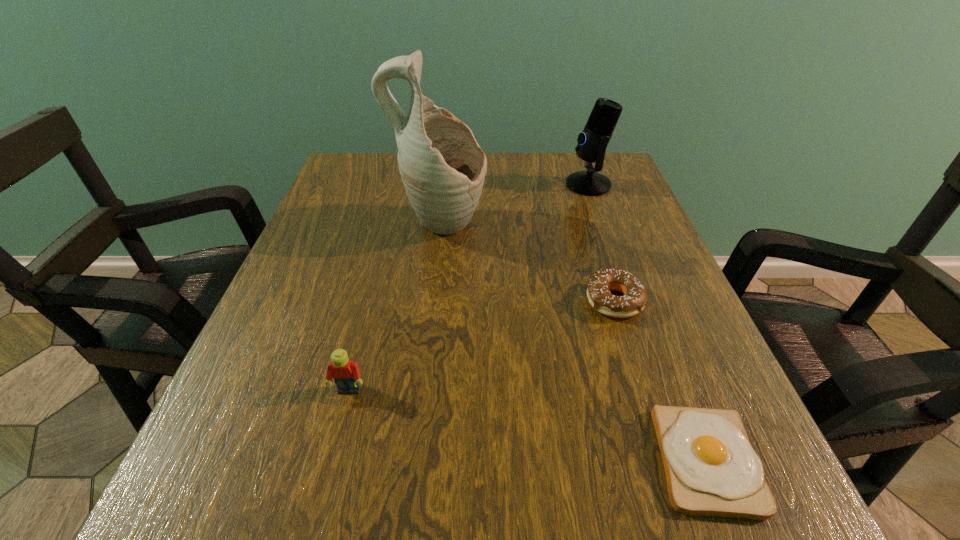
This screenshot has height=540, width=960. I want to click on the fourth nearest object, so click(x=443, y=168).

You are a GUI agent. You are given a task and a screenshot of the screen. Output one action in this format:
    pyautogui.click(x=<x>, y=<y>)
    Task: Click on the tallest object
    
    Given the screenshot: What is the action you would take?
    pyautogui.click(x=443, y=168)

Identify the location of the farthest object. The height and width of the screenshot is (540, 960). (592, 142).

You are a GUI agent. You are given a task and a screenshot of the screen. Output one action in this format:
    pyautogui.click(x=<x>, y=<y>)
    Task: Click on the microphone
    The height and width of the screenshot is (540, 960).
    Given the screenshot: What is the action you would take?
    pyautogui.click(x=592, y=142)

I want to click on the third tallest object, so pyautogui.click(x=346, y=375).

This screenshot has width=960, height=540. I want to click on the fourth farthest object, so click(x=346, y=375).

Locate an element on the screen. Image resolution: width=960 pixels, height=540 pixels. the second shortest object is located at coordinates (600, 283).

Identify the location of the third farthest object. The image size is (960, 540). (600, 283).

Locate an element on the screen. This screenshot has height=540, width=960. toast is located at coordinates (711, 469).

You are a GUI agent. You are given a task and a screenshot of the screen. Output one action in this format:
    pyautogui.click(x=<x>, y=<y>)
    Task: Click on the shortest object
    This screenshot has height=540, width=960.
    Given the screenshot: What is the action you would take?
    pyautogui.click(x=711, y=469)